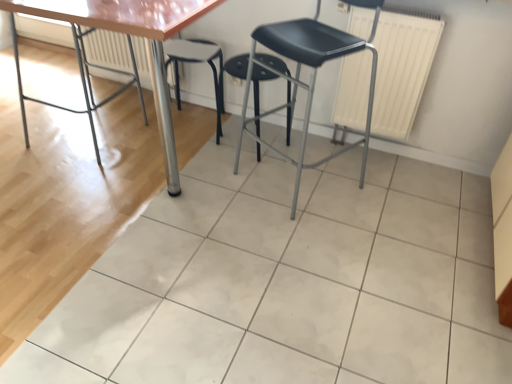
The height and width of the screenshot is (384, 512). Identify the location of free region under metallic polished table at left (from a real-world perspective). pyautogui.click(x=91, y=134).